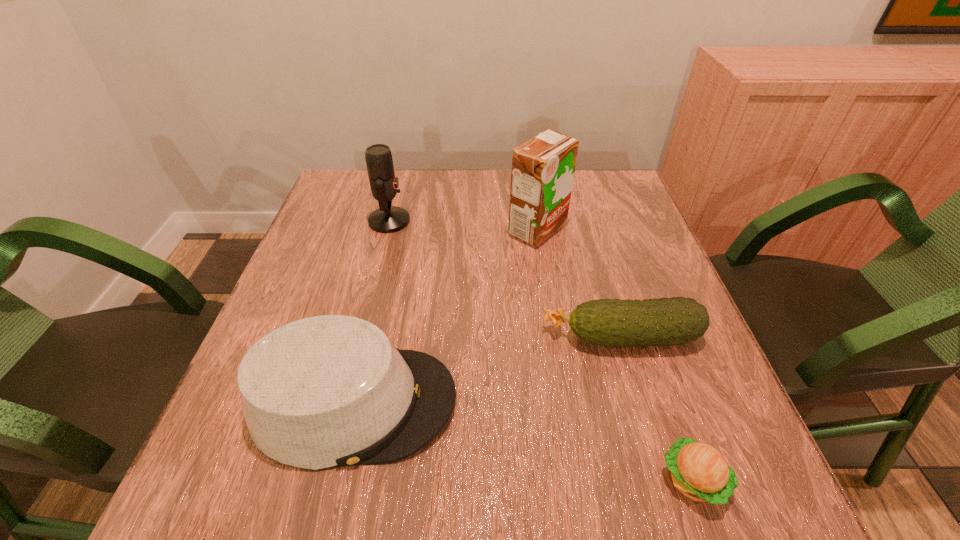
Identify the location of cucumber at the right edge. (667, 321).

Locate an element on the screen. The height and width of the screenshot is (540, 960). hamburger that is at the right edge is located at coordinates click(x=699, y=471).

At what (x,y) coordinates should I click in order to perform the action: click on object located in the far left corner section of the desktop. Please return your answer as a coordinate pair (x, y). Looking at the image, I should click on (387, 219).

Find the location of `object located in the near left corner section of the desktop`. object located in the near left corner section of the desktop is located at coordinates (327, 391).

Locate an element on the screen. This screenshot has width=960, height=540. object at the near right corner is located at coordinates click(699, 471).

Locate an element on the screen. Image resolution: width=960 pixels, height=540 pixels. free region at the far edge is located at coordinates (459, 176).

This screenshot has height=540, width=960. Find the location of `vacant space at the near edge of the desktop`. vacant space at the near edge of the desktop is located at coordinates [618, 466].

What are the coordinates of `vacant area at the right edge` in the screenshot? It's located at (674, 352).

In the image, there is a desktop. In order to click on vacant area at the far left corner in this screenshot , I will do `click(344, 188)`.

Find the location of `free space at the near left corner`. free space at the near left corner is located at coordinates (228, 484).